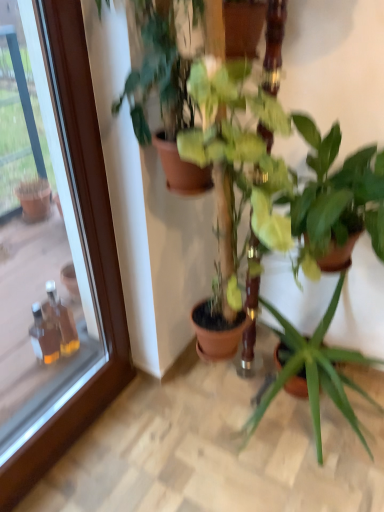
Question: From a real-world perspective, does green glossy plant at center, which appears as the 3th houseplant when viewed from the right, sit lower than green glossy plant at center, which is counted as the third houseplant, starting from the left?

Choices:
 (A) yes
 (B) no

Answer: (A)

Question: Considering the relative sizes of green glossy plant at center, which appears as the 3th houseplant when viewed from the right, and green glossy plant at center, which is counted as the third houseplant, starting from the left, in the image provided, is green glossy plant at center, which appears as the 3th houseplant when viewed from the right, shorter than green glossy plant at center, which is counted as the third houseplant, starting from the left,?

Choices:
 (A) no
 (B) yes

Answer: (A)

Question: Could green glossy plant at center, which is counted as the third houseplant, starting from the left, be considered to be inside green glossy plant at center, the 2th houseplant when ordered from left to right?

Choices:
 (A) yes
 (B) no

Answer: (B)

Question: Is the depth of green glossy plant at center, the 2th houseplant when ordered from left to right, less than that of green glossy plant at center, positioned as the second houseplant in right-to-left order?

Choices:
 (A) yes
 (B) no

Answer: (A)

Question: Considering the relative positions of green glossy plant at center, the 2th houseplant when ordered from left to right, and green glossy plant at center, which is counted as the third houseplant, starting from the left, in the image provided, is green glossy plant at center, the 2th houseplant when ordered from left to right, to the right of green glossy plant at center, which is counted as the third houseplant, starting from the left, from the viewer's perspective?

Choices:
 (A) no
 (B) yes

Answer: (A)

Question: From the image's perspective, is green glossy plant at center, the 2th houseplant when ordered from left to right, under green glossy plant at center, which is counted as the third houseplant, starting from the left?

Choices:
 (A) yes
 (B) no

Answer: (A)

Question: From the image's perspective, is transparent glass door at upper left over green matte plant at center, which ranks as the 1th houseplant in left-to-right order?

Choices:
 (A) no
 (B) yes

Answer: (A)

Question: Is transparent glass door at upper left closer to camera compared to green matte plant at center, which ranks as the 1th houseplant in left-to-right order?

Choices:
 (A) no
 (B) yes

Answer: (B)

Question: Are transparent glass door at upper left and green matte plant at center, which ranks as the 1th houseplant in left-to-right order, beside each other?

Choices:
 (A) yes
 (B) no

Answer: (B)

Question: Is transparent glass door at upper left to the right of green matte plant at center, which ranks as the 1th houseplant in left-to-right order, from the viewer's perspective?

Choices:
 (A) no
 (B) yes

Answer: (A)

Question: Is transparent glass door at upper left positioned with its back to green matte plant at center, acting as the 4th houseplant starting from the right?

Choices:
 (A) yes
 (B) no

Answer: (B)

Question: Is transparent glass door at upper left aimed at green matte plant at center, which ranks as the 1th houseplant in left-to-right order?

Choices:
 (A) yes
 (B) no

Answer: (A)

Question: From the image's perspective, is green glossy plant at center, which is counted as the third houseplant, starting from the left, on green matte plant at center, the 1th houseplant positioned from the right?

Choices:
 (A) yes
 (B) no

Answer: (A)